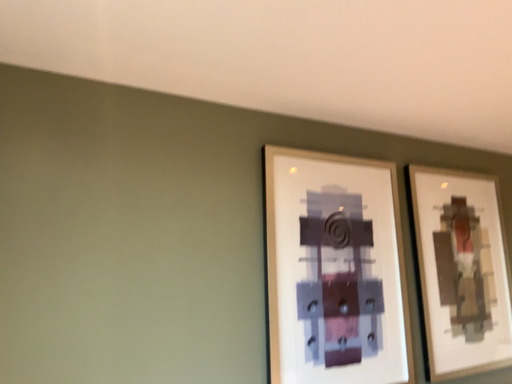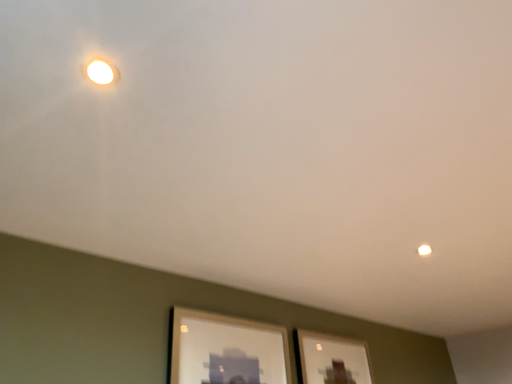
Question: Which way did the camera rotate in the video?

Choices:
 (A) rotated upward
 (B) rotated downward

Answer: (A)